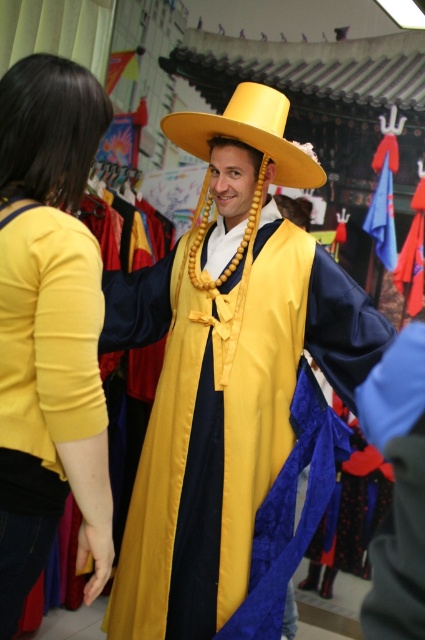
Between point (235, 184) and point (269, 93), which one is positioned in front?

Point (235, 184) is more forward.

Can you confirm if satin yellow robe at center is positioned to the left of yellow matte cowboy hat at center?

Indeed, satin yellow robe at center is positioned on the left side of yellow matte cowboy hat at center.

Where is `satin yellow robe at center`? The width and height of the screenshot is (425, 640). satin yellow robe at center is located at coordinates (226, 369).

The height and width of the screenshot is (640, 425). Identify the location of satin yellow robe at center. (226, 369).

Does matte yellow blouse at left lie in front of yellow matte cowboy hat at center?

Yes, it is in front of yellow matte cowboy hat at center.

Can you confirm if matte yellow blouse at left is positioned below yellow matte cowboy hat at center?

Yes.

Where is `matte yellow blouse at left`? This screenshot has height=640, width=425. matte yellow blouse at left is located at coordinates (48, 324).

Does satin yellow robe at center appear on the left side of matte yellow blouse at left?

No, satin yellow robe at center is not to the left of matte yellow blouse at left.

Which is more to the right, satin yellow robe at center or matte yellow blouse at left?

From the viewer's perspective, satin yellow robe at center appears more on the right side.

Which is behind, point (252, 97) or point (85, 138)?

Point (252, 97)

At what (x,y) coordinates should I click in order to perform the action: click on satin yellow robe at center. Please return your answer as a coordinate pair (x, y). Image resolution: width=425 pixels, height=640 pixels. Looking at the image, I should click on (226, 369).